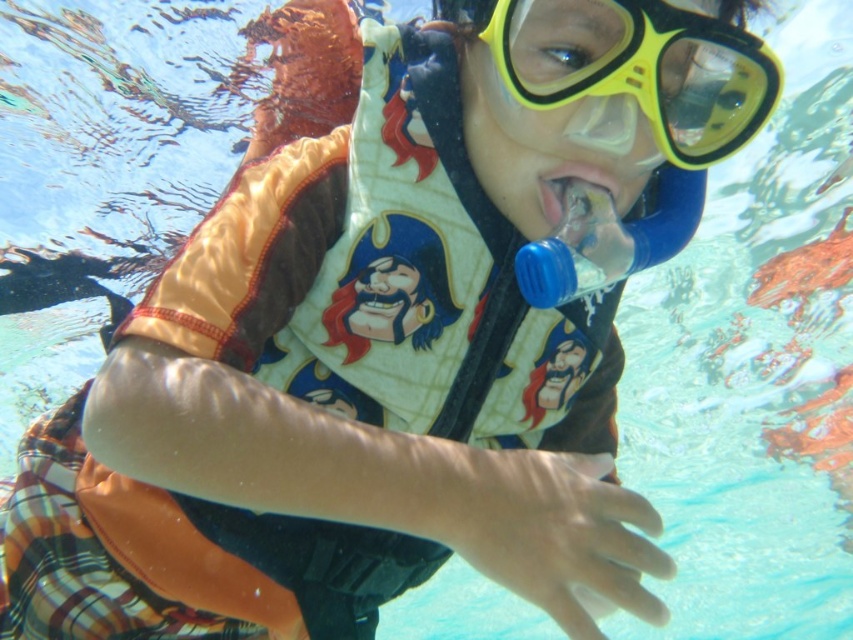
You are a lifeguard observing a child underwater. You notice a blue plastic bottle at center and a translucent plastic mouth at center. Which object is positioned to the right of the other?

The blue plastic bottle at center is to the right of the translucent plastic mouth at center.

You are a lifeguard observing a child in the pool. You notice the yellow matte snorkel mask at upper center and the translucent plastic mouth at center. Which object is positioned higher in the water?

The yellow matte snorkel mask at upper center is positioned higher in the water than the translucent plastic mouth at center.